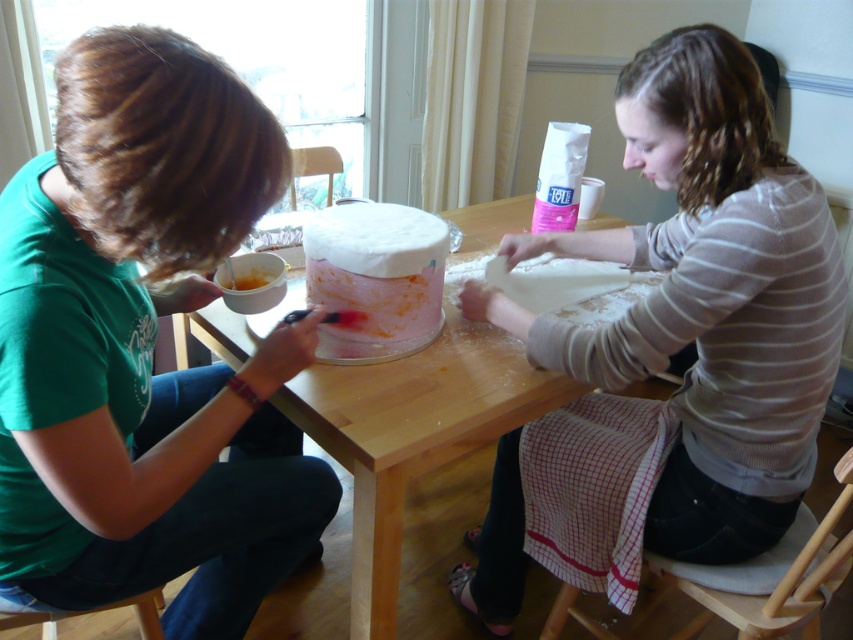
How much distance is there between green matte shirt at left and white frosted cake at center?

The distance of green matte shirt at left from white frosted cake at center is 11.07 inches.

Can you confirm if green matte shirt at left is positioned to the right of white frosted cake at center?

Incorrect, green matte shirt at left is not on the right side of white frosted cake at center.

Identify the location of green matte shirt at left. The image size is (853, 640). point(144,348).

Between point (746, 342) and point (428, 234), which one is positioned in front?

Positioned in front is point (746, 342).

Which of these two, white striped sweater at center or white frosted cake at center, stands shorter?

Standing shorter between the two is white frosted cake at center.

The width and height of the screenshot is (853, 640). I want to click on white striped sweater at center, so click(708, 298).

Between green matte shirt at left and orange smoothie at center, which one has more height?

Standing taller between the two is green matte shirt at left.

Does green matte shirt at left have a lesser width compared to orange smoothie at center?

Incorrect, green matte shirt at left's width is not less than orange smoothie at center's.

Who is more forward, [111,86] or [236,276]?

Positioned in front is point [111,86].

Image resolution: width=853 pixels, height=640 pixels. What are the coordinates of `green matte shirt at left` in the screenshot? It's located at (144, 348).